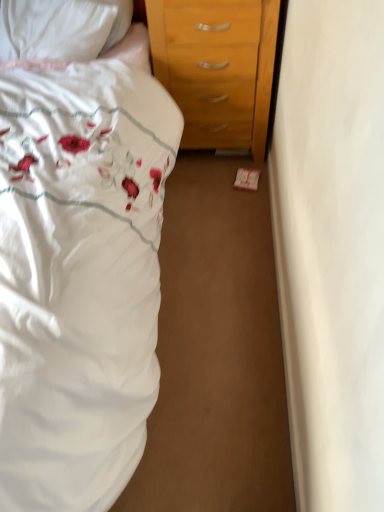
Question: Is white floral fabric bed at left inside or outside of white satin pillow at upper left?

Choices:
 (A) inside
 (B) outside

Answer: (B)

Question: From a real-world perspective, is white floral fabric bed at left above or below white satin pillow at upper left?

Choices:
 (A) below
 (B) above

Answer: (A)

Question: In the image, is white floral fabric bed at left positioned in front of or behind white satin pillow at upper left?

Choices:
 (A) front
 (B) behind

Answer: (A)

Question: In the image, is white satin pillow at upper left positioned in front of or behind white floral fabric bed at left?

Choices:
 (A) front
 (B) behind

Answer: (B)

Question: In terms of height, does white satin pillow at upper left look taller or shorter compared to white floral fabric bed at left?

Choices:
 (A) short
 (B) tall

Answer: (A)

Question: From a real-world perspective, is white satin pillow at upper left positioned above or below white floral fabric bed at left?

Choices:
 (A) below
 (B) above

Answer: (B)

Question: Based on their positions, is white satin pillow at upper left located to the left or right of white floral fabric bed at left?

Choices:
 (A) right
 (B) left

Answer: (A)